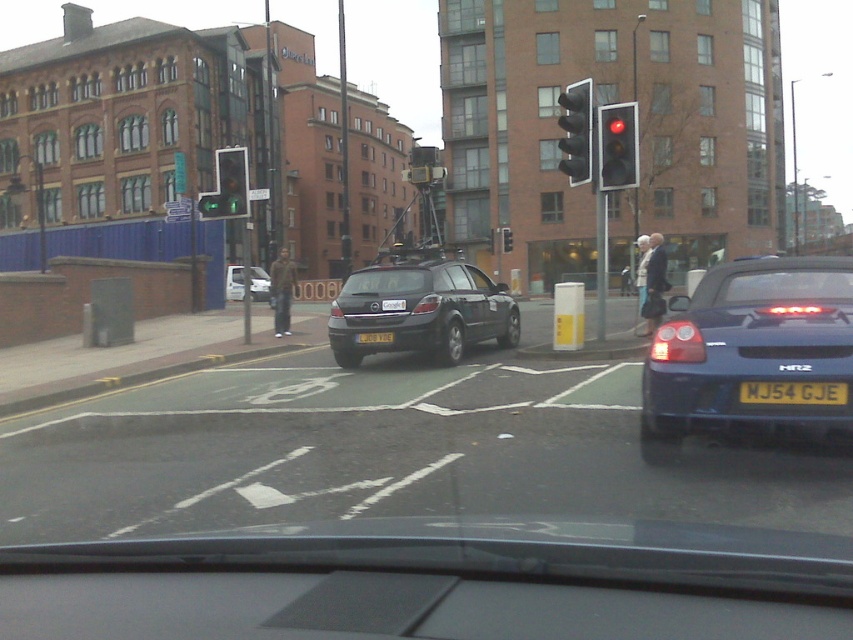
You are driving a car with a 5.2 meter turning radius. You need to make a sharp turn to avoid an obstacle at point (639, 428). Can your car make the turn without hitting anything?

The distance of point (639, 428) from viewer is 9.33 meters. Since your car has a 5.2 meter turning radius, it can safely make the turn as the distance is greater than the required turning space.

You are a passenger in a car stopped at a traffic light. You notice a point marked at coordinates (234, 282) in the scene. What object is located at this point?

The point at coordinates (234, 282) marks the white glossy car at center.